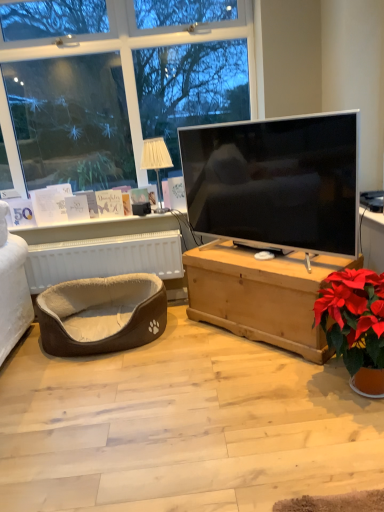
Question: Should I look upward or downward to see white fabric pet bed at lower left?

Choices:
 (A) up
 (B) down

Answer: (B)

Question: From a real-world perspective, does white fabric pet bed at lower left stand above matte black tv at center?

Choices:
 (A) yes
 (B) no

Answer: (B)

Question: Does white fabric pet bed at lower left have a greater height compared to matte black tv at center?

Choices:
 (A) no
 (B) yes

Answer: (A)

Question: Does white fabric pet bed at lower left have a larger size compared to matte black tv at center?

Choices:
 (A) no
 (B) yes

Answer: (A)

Question: From a real-world perspective, is white fabric pet bed at lower left positioned under matte black tv at center based on gravity?

Choices:
 (A) no
 (B) yes

Answer: (B)

Question: Considering the relative sizes of white fabric pet bed at lower left and matte black tv at center in the image provided, is white fabric pet bed at lower left shorter than matte black tv at center?

Choices:
 (A) yes
 (B) no

Answer: (A)

Question: Is white fabric pet bed at lower left far from matte black tv at center?

Choices:
 (A) yes
 (B) no

Answer: (B)

Question: Is white fabric pet bed at lower left wider than white fabric lampshade at upper center?

Choices:
 (A) yes
 (B) no

Answer: (B)

Question: From a real-world perspective, is white fabric pet bed at lower left on top of white fabric lampshade at upper center?

Choices:
 (A) no
 (B) yes

Answer: (A)

Question: Is white fabric pet bed at lower left positioned behind white fabric lampshade at upper center?

Choices:
 (A) yes
 (B) no

Answer: (A)

Question: Is white fabric pet bed at lower left smaller than white fabric lampshade at upper center?

Choices:
 (A) no
 (B) yes

Answer: (A)

Question: Is white fabric pet bed at lower left far from white fabric lampshade at upper center?

Choices:
 (A) no
 (B) yes

Answer: (A)

Question: Can you confirm if white fabric pet bed at lower left is bigger than white fabric lampshade at upper center?

Choices:
 (A) no
 (B) yes

Answer: (B)

Question: Considering the relative sizes of white fabric lampshade at upper center and matte black tv at center in the image provided, is white fabric lampshade at upper center thinner than matte black tv at center?

Choices:
 (A) yes
 (B) no

Answer: (B)